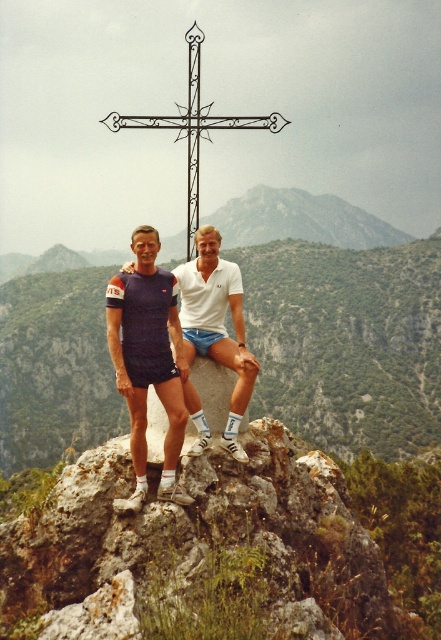
You are a hiker planning to move from the point at coordinates point (137, 422) to the point at coordinates point (235, 451) on the rocky outcrop. Considering the terrain described, which direction should you move relative to your current position?

You should move backward because point (137, 422) is closer to the viewer than point (235, 451), so moving away from the viewer would take you towards the latter point.

You are a photographer planning to take a group photo of the two people in the scene. The camera you are using has a minimum focusing distance of 5 feet. Will both the matte blue shorts at center and the white cotton polo shirt at center be in focus if you position the camera to focus on the closer person?

The matte blue shorts at center and white cotton polo shirt at center are 4.35 feet apart from each other. Since the camera requires a minimum focusing distance of 5 feet, the 4.35 feet gap is less than the required distance. Therefore, both subjects may not be in focus as the depth of field might not cover both at this distance.